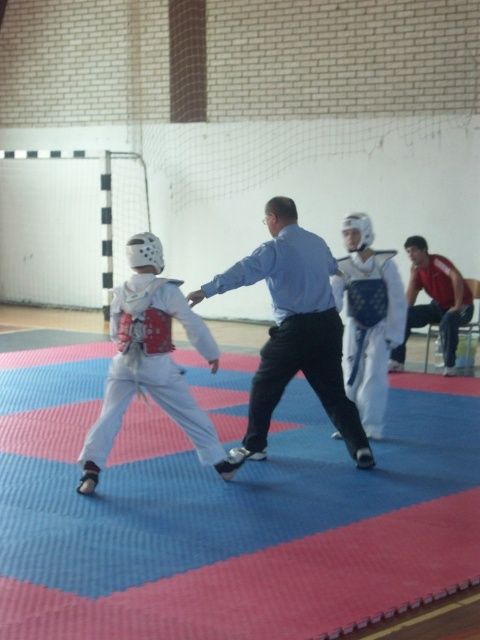
You are a martial arts instructor observing the training session. You notice the blue rubber mat at center and the white matte karate uniform at left. Which object is closer to the front of the image?

The blue rubber mat at center is shorter than the white matte karate uniform at left, so the white matte karate uniform at left is closer to the front of the image.

You are a photographer setting up for a martial arts competition. You need to ensure that the blue shirt at center and the white matte uniform at center are both clearly visible in your shot. Considering their sizes, which one should you focus on first to ensure proper framing?

The blue shirt at center is larger in size than the white matte uniform at center, so you should focus on the blue shirt at center first to ensure it fits within the frame properly.

You are observing a martial arts sparring match from the back of the gym. Two points are marked on the mat where the fighters are positioned. The first point is at coordinates point [294,531] and the second is at point [364,374]. Which point is closer to you?

Point [364,374] is closer to you because it is behind point [294,531].